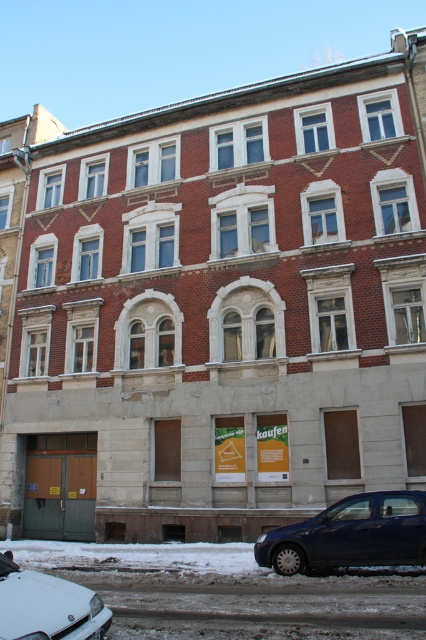
Does dark blue metallic car at lower right appear on the right side of white matte car at lower left?

Indeed, dark blue metallic car at lower right is positioned on the right side of white matte car at lower left.

Who is positioned more to the right, dark blue metallic car at lower right or white matte car at lower left?

dark blue metallic car at lower right

Describe the element at coordinates (351, 534) in the screenshot. I see `dark blue metallic car at lower right` at that location.

Image resolution: width=426 pixels, height=640 pixels. Find the location of `dark blue metallic car at lower right`. dark blue metallic car at lower right is located at coordinates (351, 534).